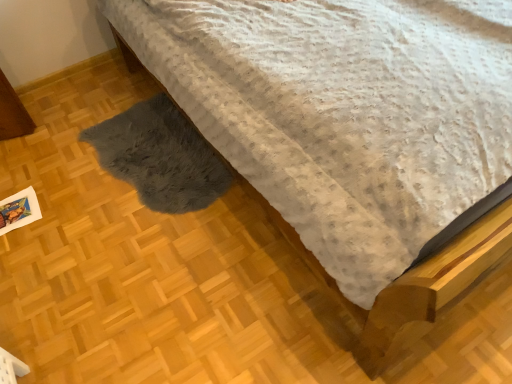
This screenshot has width=512, height=384. I want to click on free location to the left of gray furry mat at lower left, so click(53, 171).